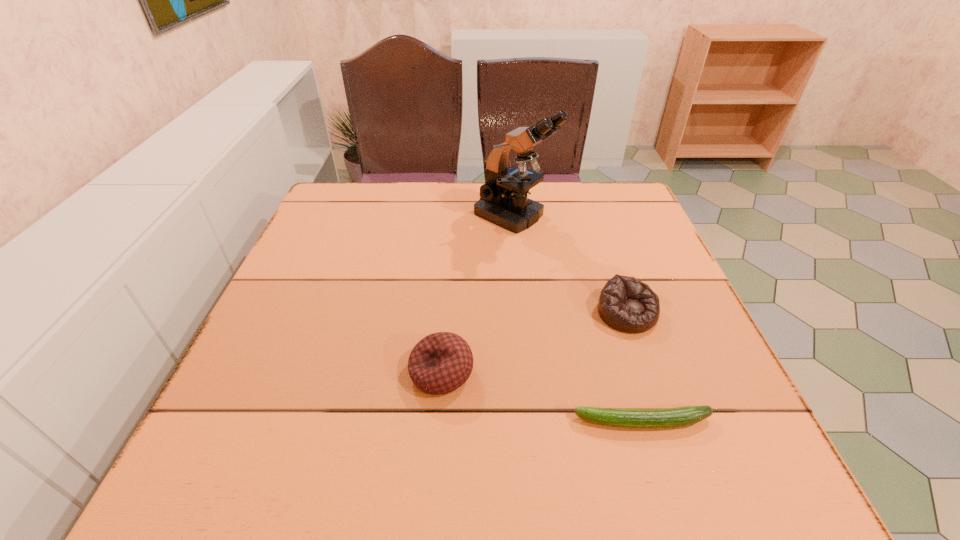
The image size is (960, 540). I want to click on vacant area that lies between the farther beanbag and the zucchini, so click(x=635, y=367).

I want to click on empty location between the shortest object and the taller beanbag, so click(542, 397).

Where is `empty location between the zucchini and the farther beanbag`? empty location between the zucchini and the farther beanbag is located at coordinates (635, 367).

You are a GUI agent. You are given a task and a screenshot of the screen. Output one action in this format:
    pyautogui.click(x=<x>, y=<y>)
    Task: Click on the free spot between the second nearest object and the second farthest object
    The width and height of the screenshot is (960, 540).
    Given the screenshot: What is the action you would take?
    pyautogui.click(x=535, y=342)

Locate which object is the second closest to the second nearest object. Please provide its 2D coordinates. Your answer should be formatted as a tuple, i.e. [(x, y)], where the tuple contains the x and y coordinates of a point satisfying the conditions above.

[(626, 304)]

Identify which object is located as the second nearest to the tallest object. Please provide its 2D coordinates. Your answer should be formatted as a tuple, i.e. [(x, y)], where the tuple contains the x and y coordinates of a point satisfying the conditions above.

[(441, 362)]

The image size is (960, 540). I want to click on blank space that satisfies the following two spatial constraints: 1. on the front side of the right beanbag; 2. on the front-facing side of the zucchini, so click(x=665, y=422).

This screenshot has width=960, height=540. What are the coordinates of `vacant area in the image that satisfies the following two spatial constraints: 1. on the back side of the nearer beanbag; 2. on the left side of the farthest object` in the screenshot? It's located at pos(454,215).

You are a GUI agent. You are given a task and a screenshot of the screen. Output one action in this format:
    pyautogui.click(x=<x>, y=<y>)
    Task: Click on the free space that satisfies the following two spatial constraints: 1. on the front side of the microscope; 2. on the left side of the second farthest object
    Image resolution: width=960 pixels, height=540 pixels.
    Given the screenshot: What is the action you would take?
    pyautogui.click(x=523, y=313)

Where is `free region that satisfies the following two spatial constraints: 1. on the back side of the third tallest object; 2. on the right side of the second tallest object`? The width and height of the screenshot is (960, 540). free region that satisfies the following two spatial constraints: 1. on the back side of the third tallest object; 2. on the right side of the second tallest object is located at coordinates (446, 313).